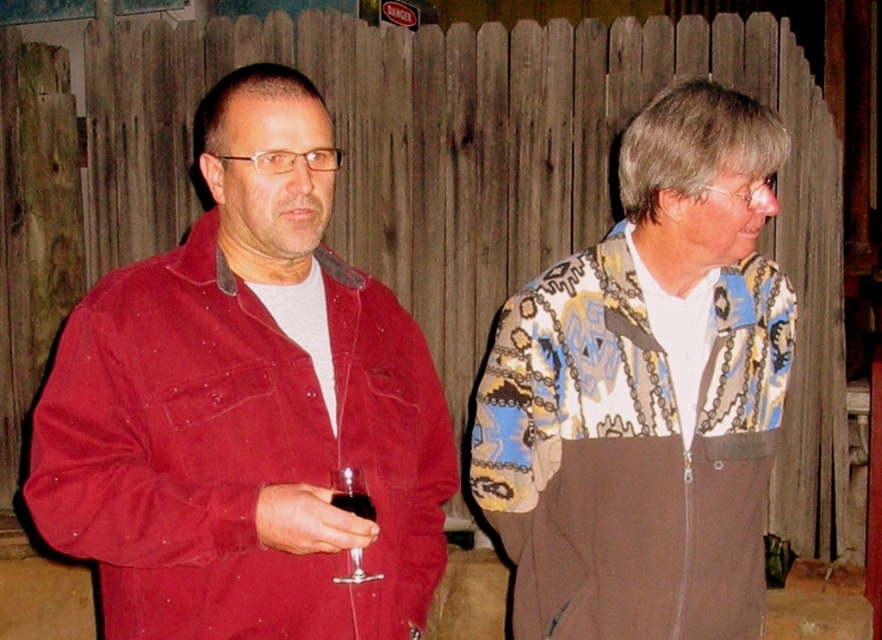
Question: Does matte red jacket at left have a smaller size compared to transparent glass at lower left?

Choices:
 (A) no
 (B) yes

Answer: (A)

Question: Can you confirm if matte red jacket at left is smaller than printed fabric jacket at right?

Choices:
 (A) no
 (B) yes

Answer: (A)

Question: Estimate the real-world distances between objects in this image. Which object is closer to the printed fabric jacket at right?

Choices:
 (A) transparent glass at lower left
 (B) matte red jacket at left

Answer: (B)

Question: Considering the relative positions of printed fabric jacket at right and transparent glass at lower left in the image provided, where is printed fabric jacket at right located with respect to transparent glass at lower left?

Choices:
 (A) below
 (B) above

Answer: (B)

Question: Which object appears closest to the camera in this image?

Choices:
 (A) matte red jacket at left
 (B) transparent glass at lower left
 (C) printed fabric jacket at right

Answer: (A)

Question: Which point is farther from the camera taking this photo?

Choices:
 (A) (589, 520)
 (B) (340, 481)

Answer: (A)